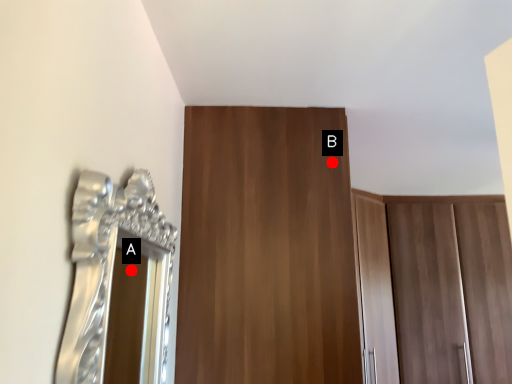
Question: Two points are circled on the image, labeled by A and B beside each circle. Which point appears closest to the camera in this image?

Choices:
 (A) A is closer
 (B) B is closer

Answer: (A)